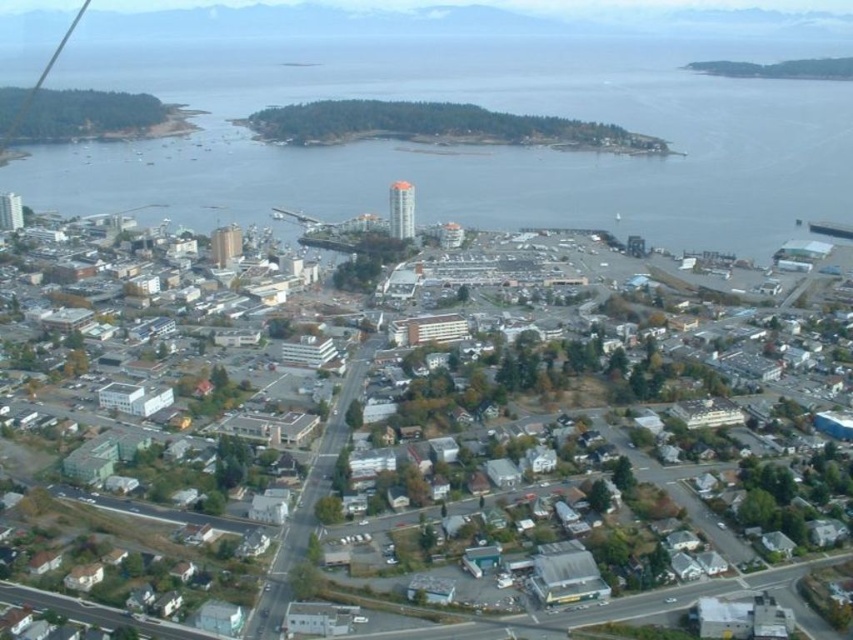
Question: Considering the relative positions of clear water at center and matte gray building at center in the image provided, where is clear water at center located with respect to matte gray building at center?

Choices:
 (A) right
 (B) left

Answer: (A)

Question: Which point is farther to the camera?

Choices:
 (A) tap(701, 51)
 (B) tap(506, 528)

Answer: (A)

Question: Which of the following is the farthest from the observer?

Choices:
 (A) (352, 467)
 (B) (83, 180)

Answer: (B)

Question: Can you confirm if clear water at center is positioned to the right of matte gray building at center?

Choices:
 (A) no
 (B) yes

Answer: (B)

Question: Can you confirm if clear water at center is thinner than matte gray building at center?

Choices:
 (A) yes
 (B) no

Answer: (B)

Question: Which point is farther from the camera taking this photo?

Choices:
 (A) (144, 74)
 (B) (486, 444)

Answer: (A)